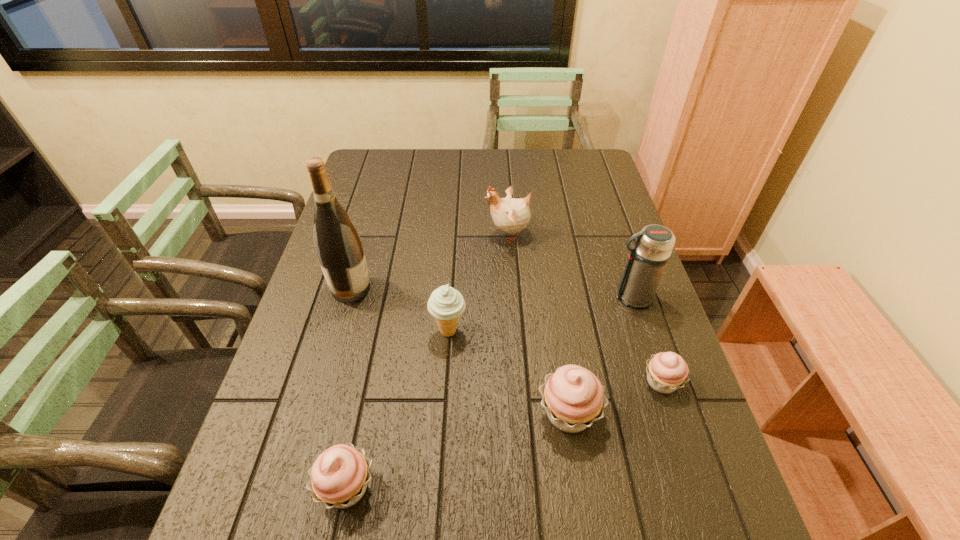
Where is `vacant region located 0.080m on the left of the nearest object`? The width and height of the screenshot is (960, 540). vacant region located 0.080m on the left of the nearest object is located at coordinates click(x=274, y=487).

Image resolution: width=960 pixels, height=540 pixels. What are the coordinates of `vacant space located on the back of the tallest cupcake` in the screenshot? It's located at (546, 270).

You are a GUI agent. You are given a task and a screenshot of the screen. Output one action in this format:
    pyautogui.click(x=<x>, y=<y>)
    Task: Click on the vacant space situated on the left of the rightmost cupcake
    The width and height of the screenshot is (960, 540).
    Given the screenshot: What is the action you would take?
    pyautogui.click(x=610, y=382)

At what (x,y) coordinates should I click in order to perform the action: click on vacant space situated 0.100m on the front of the fourth nearest object. Please return your answer as a coordinate pair (x, y). Looking at the image, I should click on (445, 382).

Locate an element on the screen. free region located at the beak of the farthest object is located at coordinates (387, 234).

At what (x,y) coordinates should I click in order to perform the action: click on vacant area located at the beak of the farthest object. Please return your answer as a coordinate pair (x, y). Looking at the image, I should click on (422, 234).

Locate an element on the screen. Image resolution: width=960 pixels, height=540 pixels. vacant space situated 0.200m at the beak of the farthest object is located at coordinates pyautogui.click(x=420, y=234).

Locate an element on the screen. Image resolution: width=960 pixels, height=540 pixels. vacant area located 0.080m on the label of the wine bottle is located at coordinates (401, 289).

In order to click on blank area located with a handle on the side of the second tallest object in this screenshot , I will do `click(577, 298)`.

Where is `vacant space situated 0.260m with a handle on the side of the second tallest object`? This screenshot has height=540, width=960. vacant space situated 0.260m with a handle on the side of the second tallest object is located at coordinates point(514,298).